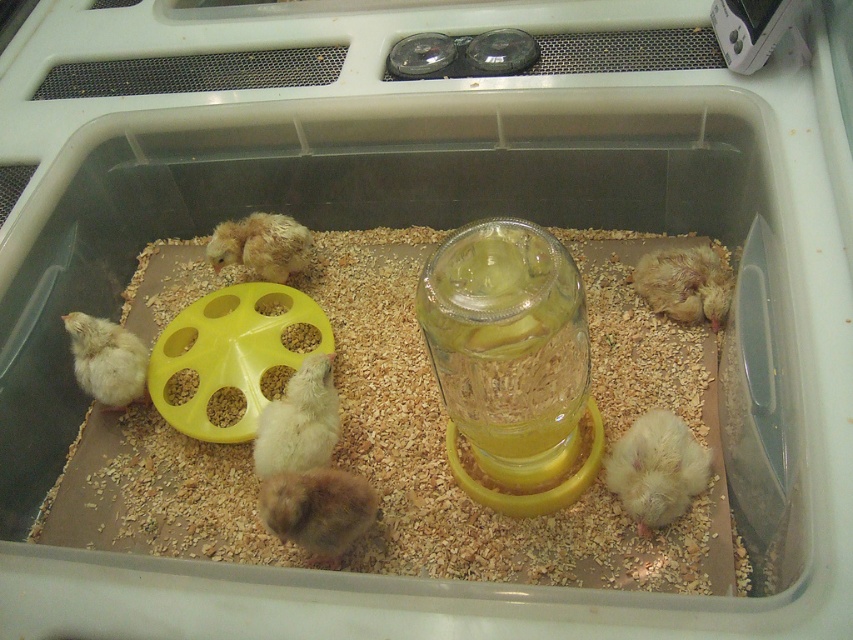
You are a caretaker of baby chicks and need to ensure they have enough space to move around. The container is 30 centimeters wide. Can both the white fluffy chick at center and the white fluffy chick at left fit comfortably side by side without overlapping?

The white fluffy chick at center is 23.40 centimeters from the white fluffy chick at left. Since the container is 30 centimeters wide, there is enough space for both chicks to fit comfortably side by side without overlapping.

You are a farmer checking on the baby chicks in their brooder. You notice two chicks, the white fluffy chick at left and the soft yellow chick at center. Which one is larger?

The white fluffy chick at left is bigger than the soft yellow chick at center.